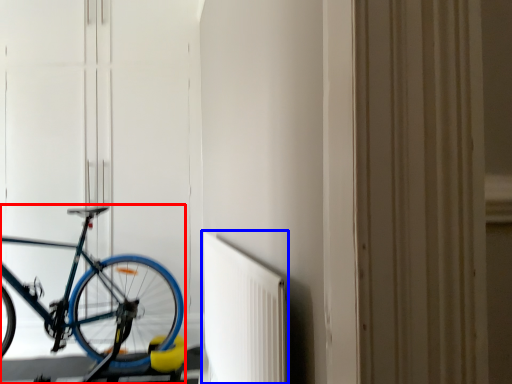
Question: Which object appears closest to the camera in this image, bicycle (highlighted by a red box) or radiator (highlighted by a blue box)?

Choices:
 (A) bicycle
 (B) radiator

Answer: (B)